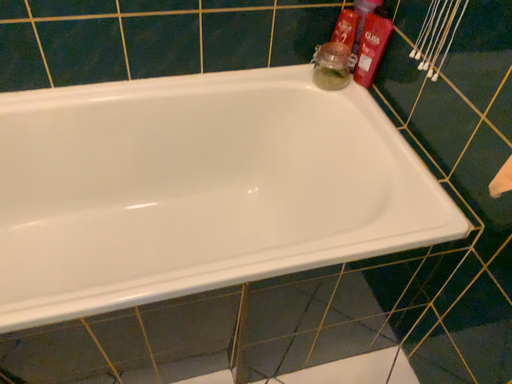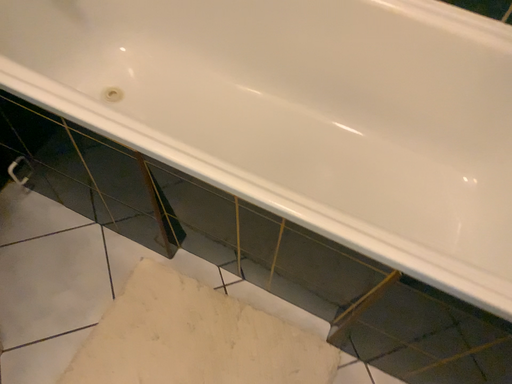
Question: How did the camera likely rotate when shooting the video?

Choices:
 (A) rotated right
 (B) rotated left

Answer: (B)